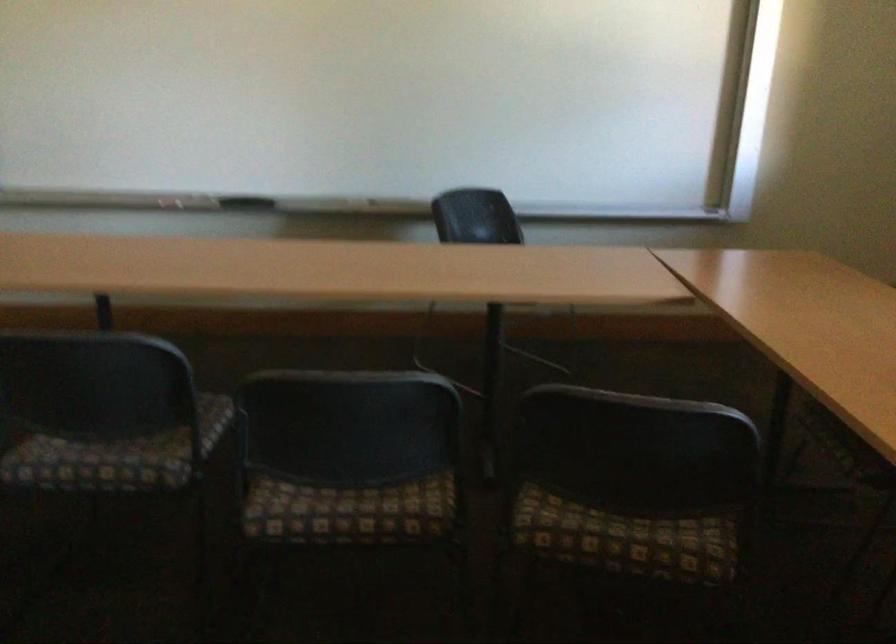
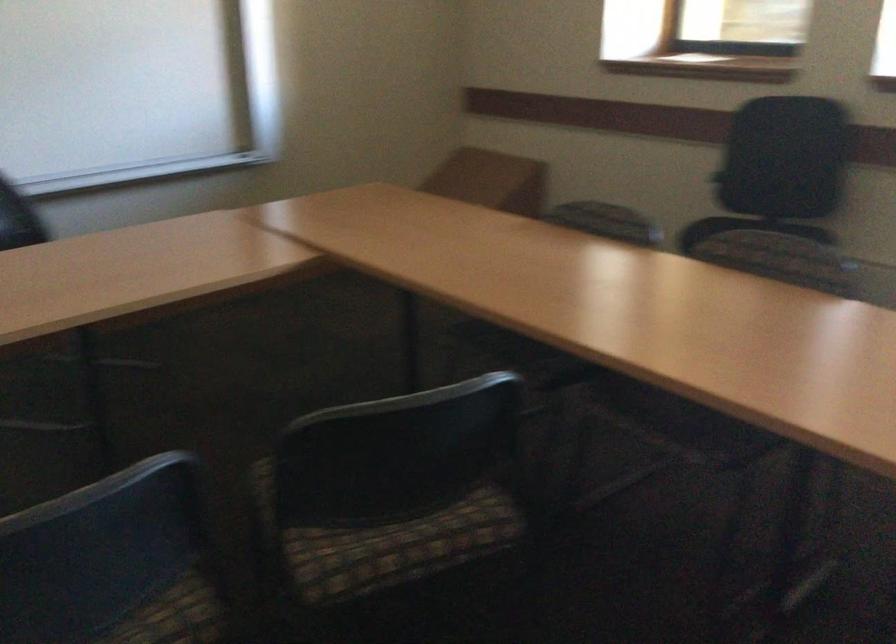
Locate, in the second image, the point that corresponds to [599,529] in the first image.

(385, 543)